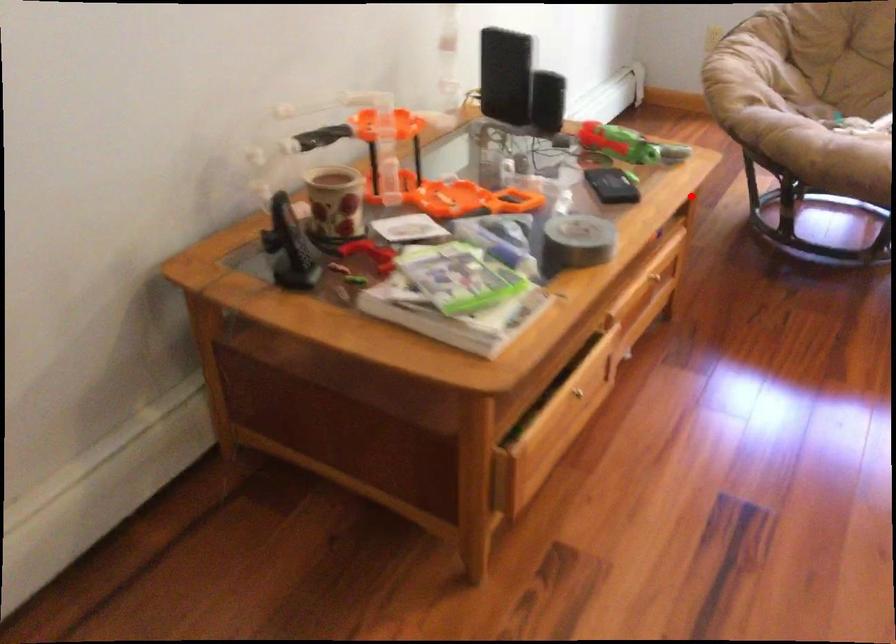
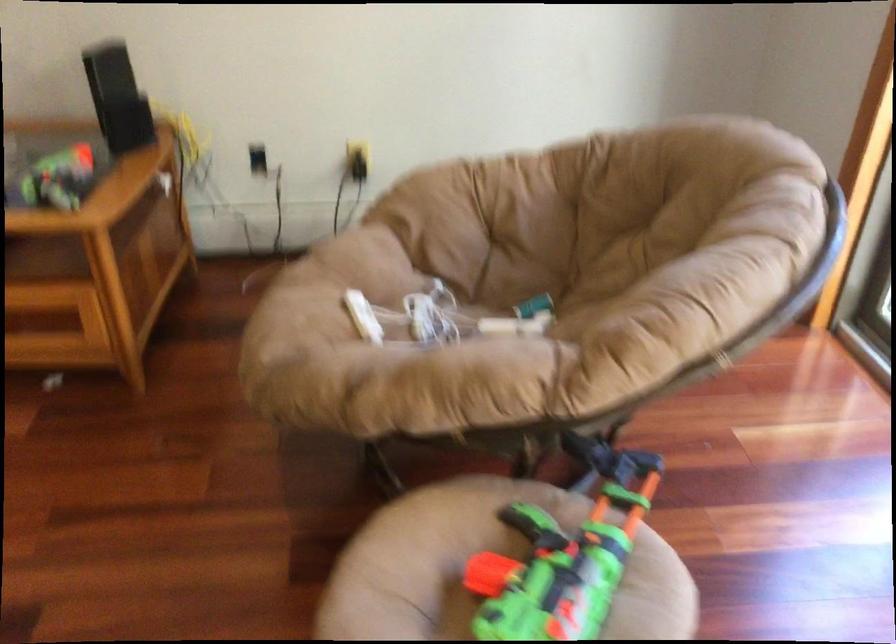
Question: I am providing you with two images of the same scene from different viewpoints. A red point is shown in image1. For the corresponding object point in image2, is it positioned nearer or farther from the camera?

Choices:
 (A) Nearer
 (B) Farther

Answer: (A)